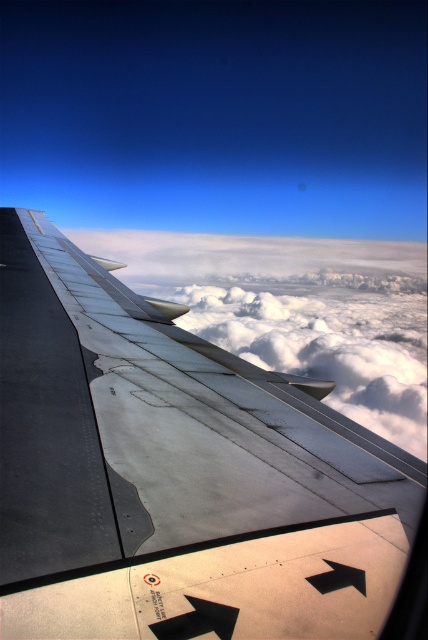
Which is more to the left, metallic gray wing at upper left or white fluffy cloud at upper center?

Positioned to the left is metallic gray wing at upper left.

Between point (243, 388) and point (145, 280), which one is positioned behind?

The point (145, 280) is behind.

This screenshot has width=428, height=640. Find the location of `metallic gray wing at upper left`. metallic gray wing at upper left is located at coordinates (175, 472).